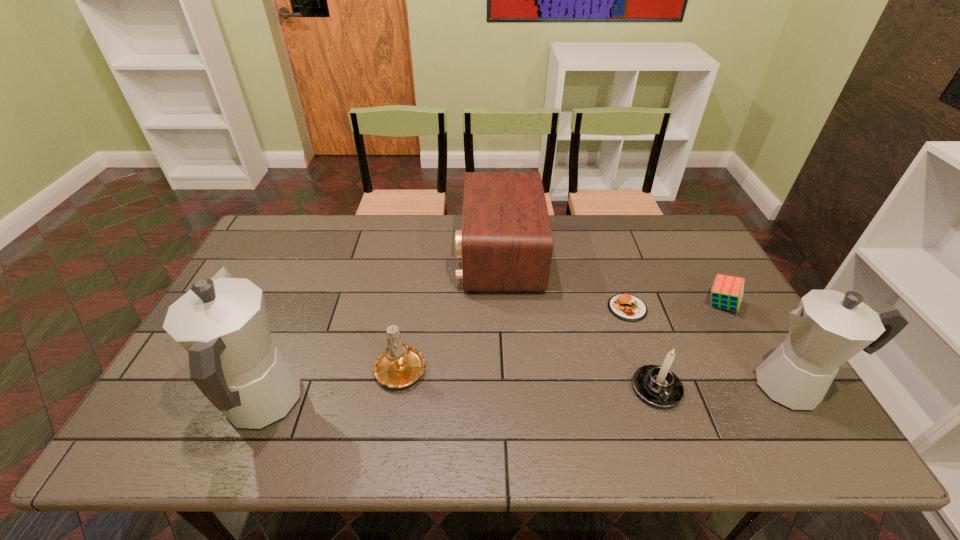
At what (x,y) coordinates should I click in order to perform the action: click on free space for an extra coffeepot to achieve even spacing. Please return your answer as a coordinate pair (x, y). Image resolution: width=960 pixels, height=540 pixels. Looking at the image, I should click on (532, 395).